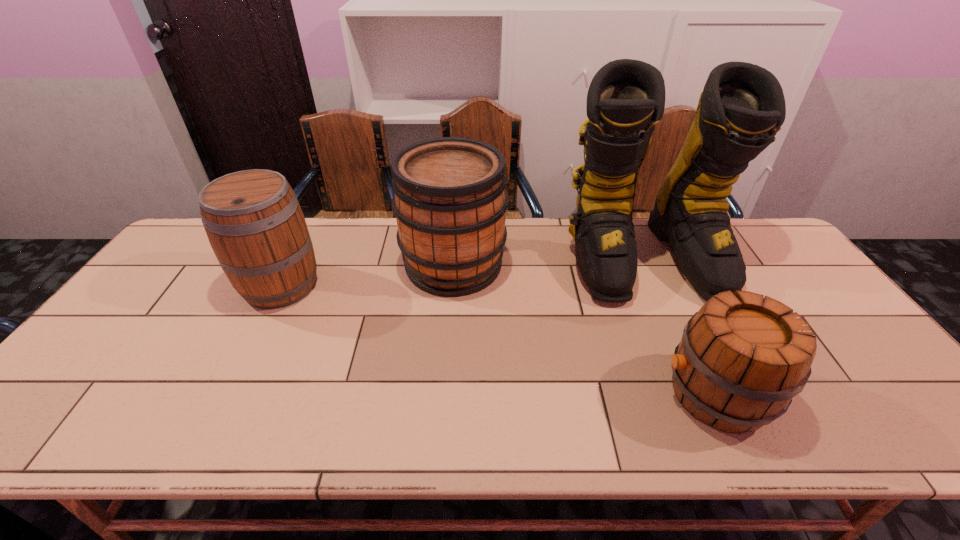
Where is `ski boots`? The image size is (960, 540). ski boots is located at coordinates (x=742, y=107).

Find the location of a particular element. This screenshot has height=540, width=960. the second object from left to right is located at coordinates (450, 202).

The height and width of the screenshot is (540, 960). In order to click on the leftmost object in this screenshot , I will do `click(254, 223)`.

I want to click on the shortest cider, so click(x=741, y=360).

Locate an element on the screen. The image size is (960, 540). the shortest object is located at coordinates (741, 360).

Locate an element on the screen. The image size is (960, 540). vacant space positioned on the front of the tallest object is located at coordinates (727, 441).

At what (x,y) coordinates should I click in order to perform the action: click on vacant space located 0.120m on the front of the second cider from left to right. Please return your answer as a coordinate pair (x, y). This screenshot has width=960, height=540. Looking at the image, I should click on (448, 333).

Image resolution: width=960 pixels, height=540 pixels. I want to click on free location located 0.070m on the front of the leftmost object, so click(x=256, y=334).

I want to click on free spot located 0.400m on the side of the rightmost cider where the spigot is located, so click(x=486, y=394).

I want to click on blank area located on the side of the rightmost cider where the spigot is located, so click(x=520, y=394).